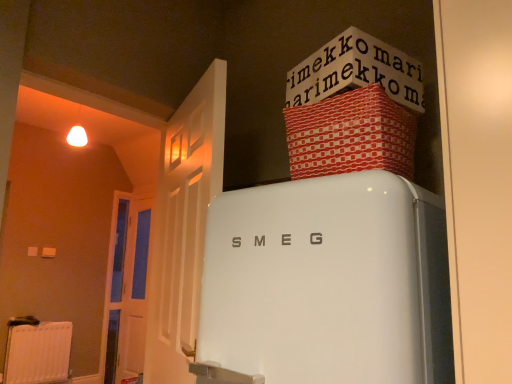
Question: Is red textured fabric box at upper right positioned in front of white glossy refrigerator at center?

Choices:
 (A) no
 (B) yes

Answer: (A)

Question: Is red textured fabric box at upper right located outside white glossy refrigerator at center?

Choices:
 (A) yes
 (B) no

Answer: (A)

Question: Does red textured fabric box at upper right have a lesser height compared to white glossy refrigerator at center?

Choices:
 (A) yes
 (B) no

Answer: (A)

Question: From a real-world perspective, does red textured fabric box at upper right stand above white glossy refrigerator at center?

Choices:
 (A) yes
 (B) no

Answer: (A)

Question: Considering the relative sizes of red textured fabric box at upper right and white glossy refrigerator at center in the image provided, is red textured fabric box at upper right smaller than white glossy refrigerator at center?

Choices:
 (A) no
 (B) yes

Answer: (B)

Question: From the image's perspective, is red textured fabric box at upper right over white glossy refrigerator at center?

Choices:
 (A) yes
 (B) no

Answer: (A)

Question: Can you confirm if white wooden door at left, the first door from the front, is thinner than white paper at upper center?

Choices:
 (A) no
 (B) yes

Answer: (B)

Question: Is white wooden door at left, which is counted as the 2th door, starting from the left, looking in the opposite direction of white paper at upper center?

Choices:
 (A) no
 (B) yes

Answer: (B)

Question: Does white wooden door at left, arranged as the first door when viewed from the right, turn towards white paper at upper center?

Choices:
 (A) yes
 (B) no

Answer: (B)

Question: Considering the relative positions of white wooden door at left, the first door from the front, and white paper at upper center in the image provided, is white wooden door at left, the first door from the front, behind white paper at upper center?

Choices:
 (A) no
 (B) yes

Answer: (A)

Question: Does white wooden door at left, the first door from the front, have a greater height compared to white paper at upper center?

Choices:
 (A) no
 (B) yes

Answer: (B)

Question: Does white wooden door at left, which is counted as the 2th door, starting from the left, have a smaller size compared to white paper at upper center?

Choices:
 (A) yes
 (B) no

Answer: (B)

Question: Does white plastic radiator at lower left have a greater height compared to white wooden door at left, which ranks as the 2th door in back-to-front order?

Choices:
 (A) no
 (B) yes

Answer: (A)